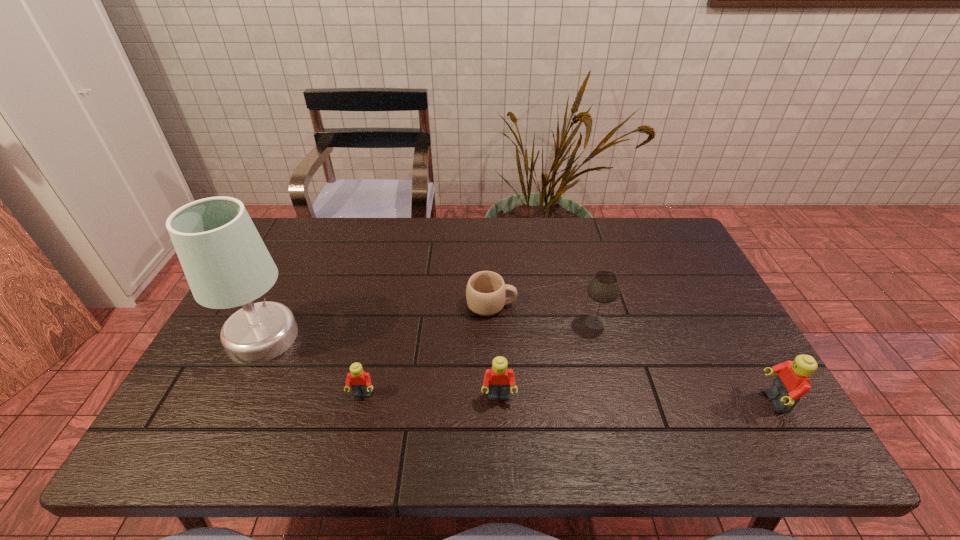
The height and width of the screenshot is (540, 960). Find the location of `free space at the near edge of the desktop`. free space at the near edge of the desktop is located at coordinates (401, 411).

I want to click on free spot at the left edge of the desktop, so click(x=301, y=279).

What are the coordinates of `free space at the right edge of the desktop` in the screenshot? It's located at (697, 273).

This screenshot has height=540, width=960. I want to click on free region at the far left corner, so click(290, 224).

The image size is (960, 540). In the image, there is a desktop. In order to click on free space at the far right corner in this screenshot , I will do `click(642, 218)`.

In the image, there is a desktop. At what (x,y) coordinates should I click in order to perform the action: click on vacant space at the near right corner. Please return your answer as a coordinate pair (x, y). The height and width of the screenshot is (540, 960). Looking at the image, I should click on (714, 400).

At what (x,y) coordinates should I click in order to perform the action: click on unoccupied area between the lampshade and the shortest object. Please return your answer as a coordinate pair (x, y). Looking at the image, I should click on (377, 321).

Locate an element on the screen. free spot between the wineglass and the leftmost Lego is located at coordinates (479, 359).

Identify the location of free space between the rightmost Lego and the second shortest Lego. pos(636,399).

The height and width of the screenshot is (540, 960). What are the coordinates of `vacant area that lies between the tallest object and the shortest object` in the screenshot? It's located at (377, 321).